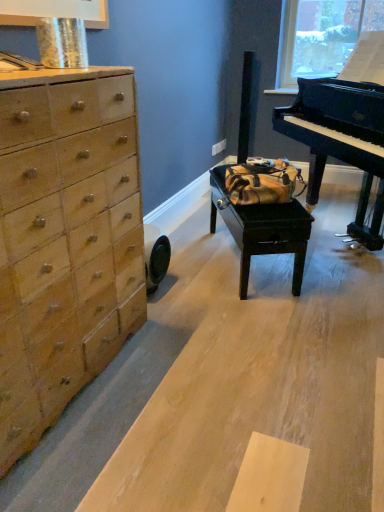
Where is `free region under wooden table at center (from a real-world perspective)`? The height and width of the screenshot is (512, 384). free region under wooden table at center (from a real-world perspective) is located at coordinates (252, 268).